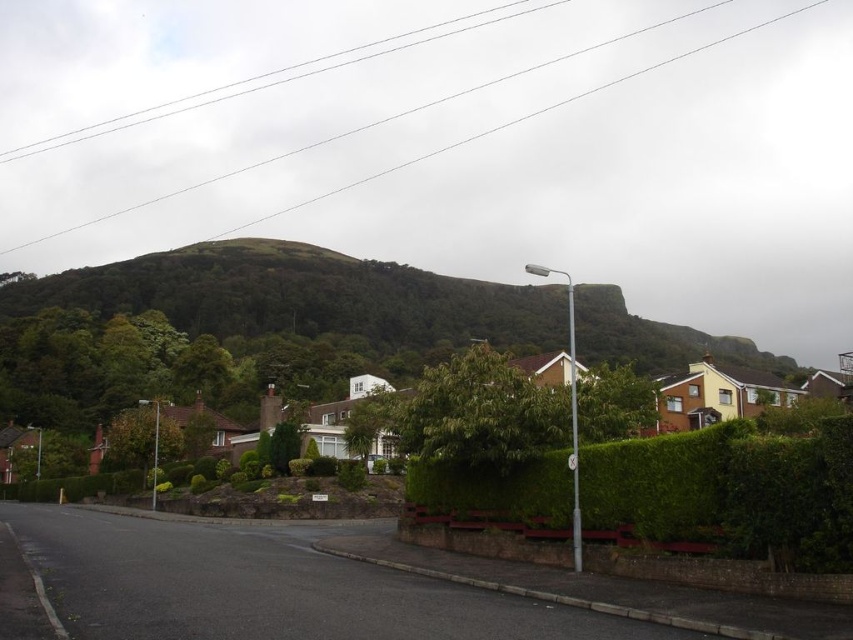
Question: Is green leafy hillside at upper center to the right of green leafy hedge at center from the viewer's perspective?

Choices:
 (A) yes
 (B) no

Answer: (B)

Question: Which point is farther from the camera taking this photo?

Choices:
 (A) (717, 525)
 (B) (518, 316)

Answer: (B)

Question: Is green leafy hillside at upper center smaller than green leafy hedge at center?

Choices:
 (A) no
 (B) yes

Answer: (A)

Question: Does green leafy hillside at upper center appear on the left side of green leafy hedge at center?

Choices:
 (A) no
 (B) yes

Answer: (B)

Question: Which object is closer to the camera taking this photo?

Choices:
 (A) green leafy hillside at upper center
 (B) green leafy hedge at center

Answer: (B)